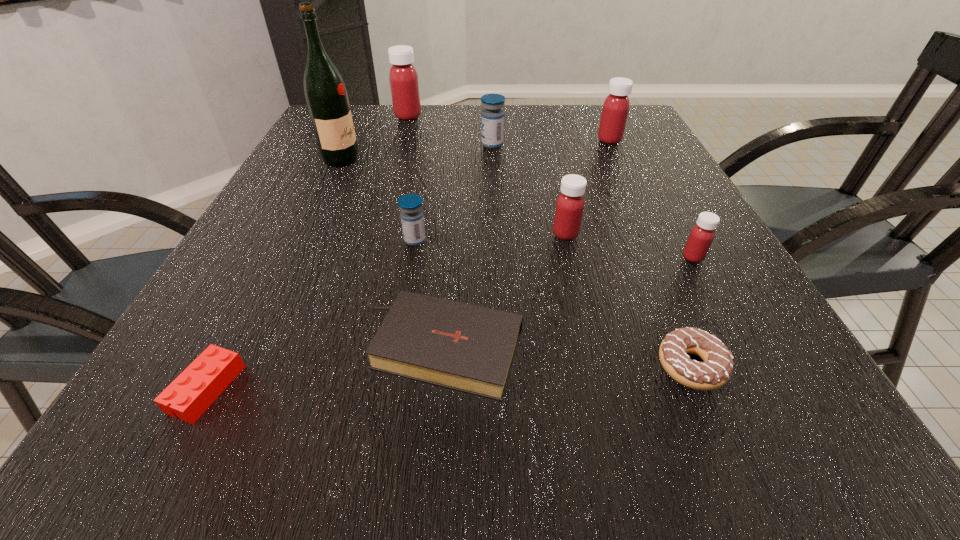
Where is `object identified as the closest to the chocolate doughnut`? object identified as the closest to the chocolate doughnut is located at coordinates (701, 236).

Select which medicine is the third closest to the third medicine from left to right. Please provide its 2D coordinates. Your answer should be formatted as a tuple, i.e. [(x, y)], where the tuple contains the x and y coordinates of a point satisfying the conditions above.

[(570, 203)]

The width and height of the screenshot is (960, 540). What are the coordinates of `medicine that is the second closest one to the seventh nearest object` in the screenshot? It's located at (412, 219).

Choose which red medicine is the nearest neighbor to the eighth shortest object. Please provide its 2D coordinates. Your answer should be formatted as a tuple, i.e. [(x, y)], where the tuple contains the x and y coordinates of a point satisfying the conditions above.

[(570, 203)]

Identify the location of red medicine object that ranks as the closest to the smaller blue medicine. Image resolution: width=960 pixels, height=540 pixels. (570, 203).

Locate an element on the screen. free space that satisfies the following two spatial constraints: 1. on the front-facing side of the seventh farthest object; 2. on the left side of the green liquor is located at coordinates (295, 257).

Find the location of `vacant region that satisfies the following two spatial constraints: 1. on the front-facing side of the green liquor; 2. on the back side of the doughnut`. vacant region that satisfies the following two spatial constraints: 1. on the front-facing side of the green liquor; 2. on the back side of the doughnut is located at coordinates (244, 366).

Locate an element on the screen. vacant space that satisfies the following two spatial constraints: 1. on the front-facing side of the tallest object; 2. on the right side of the doughnut is located at coordinates (244, 366).

The image size is (960, 540). In order to click on blank area in the image that satisfies the following two spatial constraints: 1. on the front side of the third smallest red medicine; 2. on the front-facing side of the seventh nearest object in this screenshot , I will do `click(619, 160)`.

Image resolution: width=960 pixels, height=540 pixels. I want to click on vacant region that satisfies the following two spatial constraints: 1. on the back side of the nearest medicine; 2. on the right side of the Lego, so click(x=276, y=257).